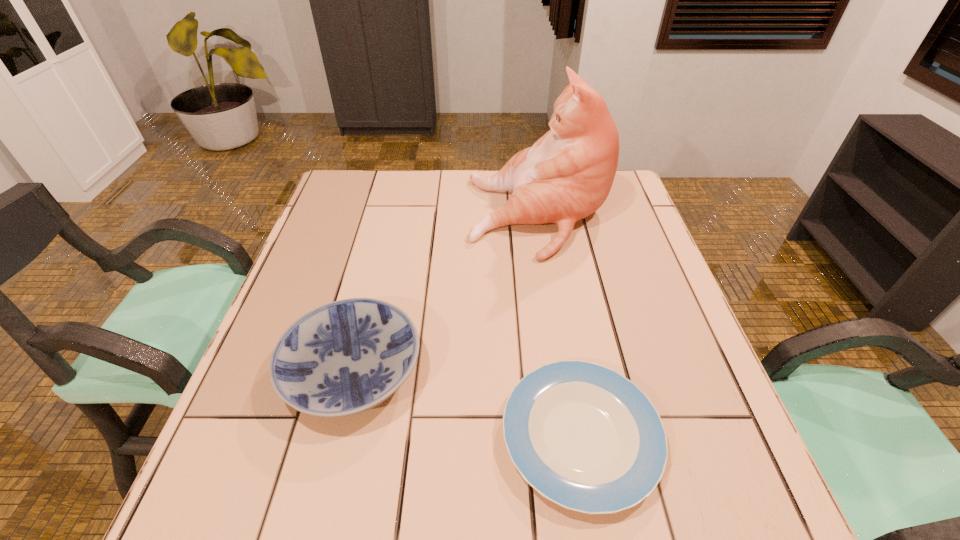
This screenshot has height=540, width=960. Identify the location of free space between the second shortest object and the right plate. (467, 403).

In order to click on free space between the taller plate and the right plate in this screenshot , I will do `click(467, 403)`.

Find the location of a particular element. The width and height of the screenshot is (960, 540). vacant area that lies between the right plate and the tallest object is located at coordinates (560, 327).

Identify the location of vacant area that lies between the taller plate and the right plate. (467, 403).

Where is `object that is the second closest to the shortest object`? object that is the second closest to the shortest object is located at coordinates (567, 174).

Select which object is the closest to the cat. Please provide its 2D coordinates. Your answer should be formatted as a tuple, i.e. [(x, y)], where the tuple contains the x and y coordinates of a point satisfying the conditions above.

[(343, 358)]

What are the coordinates of `vacant space that satisfies the following two spatial constraints: 1. on the face of the tallest object; 2. on the left side of the shorter plate` in the screenshot? It's located at (x=574, y=436).

You are a GUI agent. You are given a task and a screenshot of the screen. Output one action in this format:
    pyautogui.click(x=<x>, y=<y>)
    Task: Click on the free spot that satisfies the following two spatial constraints: 1. on the face of the tallest object; 2. on the back side of the shorter plate
    The height and width of the screenshot is (540, 960).
    Given the screenshot: What is the action you would take?
    pyautogui.click(x=574, y=436)

At what (x,y) coordinates should I click in order to perform the action: click on vacant space that satisfies the following two spatial constraints: 1. on the back side of the shortest object; 2. on the face of the farthest object. Please return your answer as a coordinate pair (x, y). Image resolution: width=960 pixels, height=540 pixels. Looking at the image, I should click on (542, 217).

The image size is (960, 540). What are the coordinates of `vacant region that satisfies the following two spatial constraints: 1. on the front side of the second shortest object; 2. on the left side of the shorter plate` in the screenshot? It's located at (337, 436).